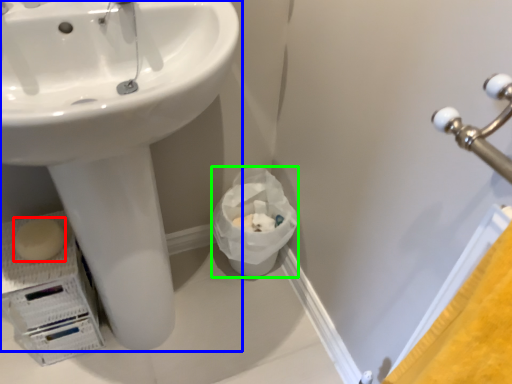
Question: Which is nearer to the soap (highlighted by a red box)? sink (highlighted by a blue box) or garbage (highlighted by a green box).

Choices:
 (A) sink
 (B) garbage

Answer: (A)